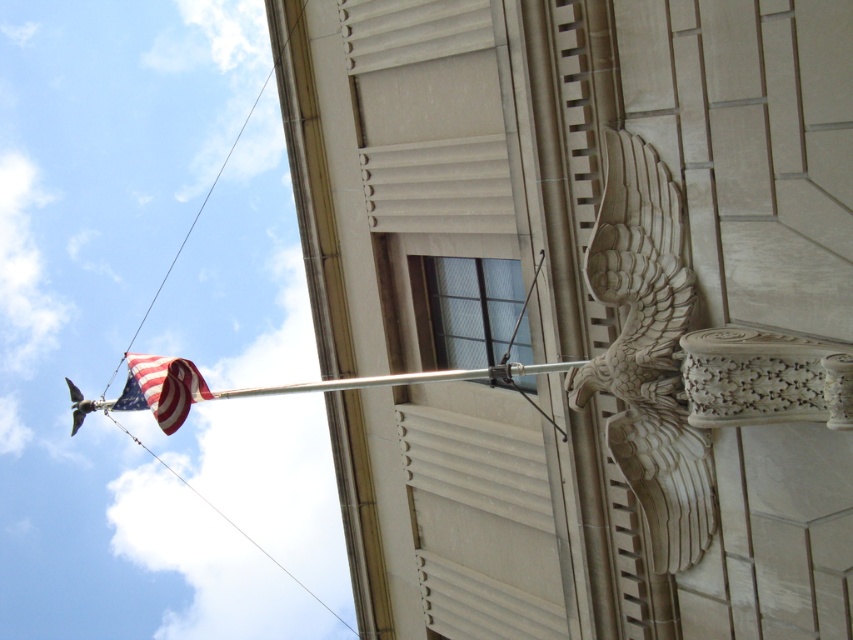
Where is `carved stone eagle at upper right`? carved stone eagle at upper right is located at coordinates (647, 352).

Which is behind, point (608, 433) or point (137, 388)?

The point (137, 388) is behind.

I want to click on carved stone eagle at upper right, so click(647, 352).